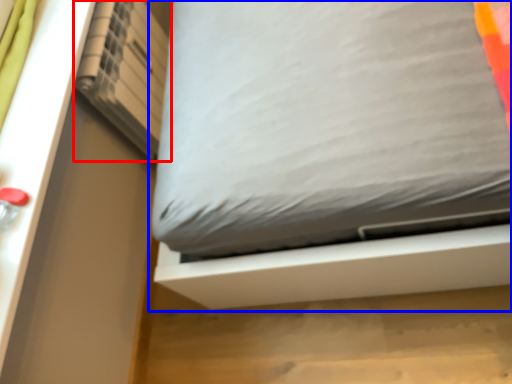
Question: Which point is further to the camera, shelf (highlighted by a red box) or bed (highlighted by a blue box)?

Choices:
 (A) shelf
 (B) bed

Answer: (A)